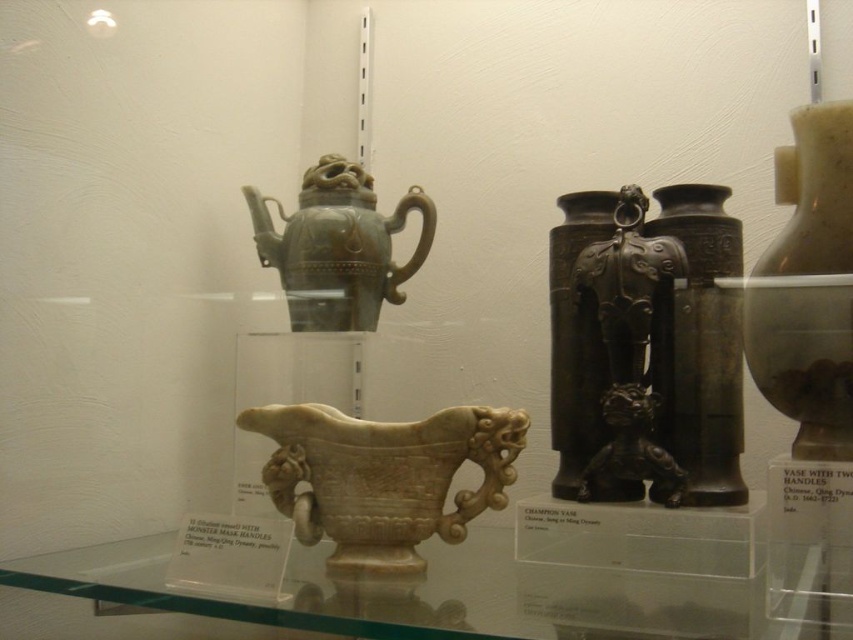
What is the position of the point with coordinates (804, 364) in the image?

The point with coordinates (804, 364) is located on the matte brown vase at upper right.

You are an interior designer planning to place a large decorative item in a corner that can only accommodate items up to 30 cm in height. You have the matte brown vase at upper right and the bronze textured vase at center available. Which vase should you choose to ensure it fits in the space?

The bronze textured vase at center is smaller in size compared to the matte brown vase at upper right, so the bronze textured vase at center should be chosen to fit in the 30 cm height space.